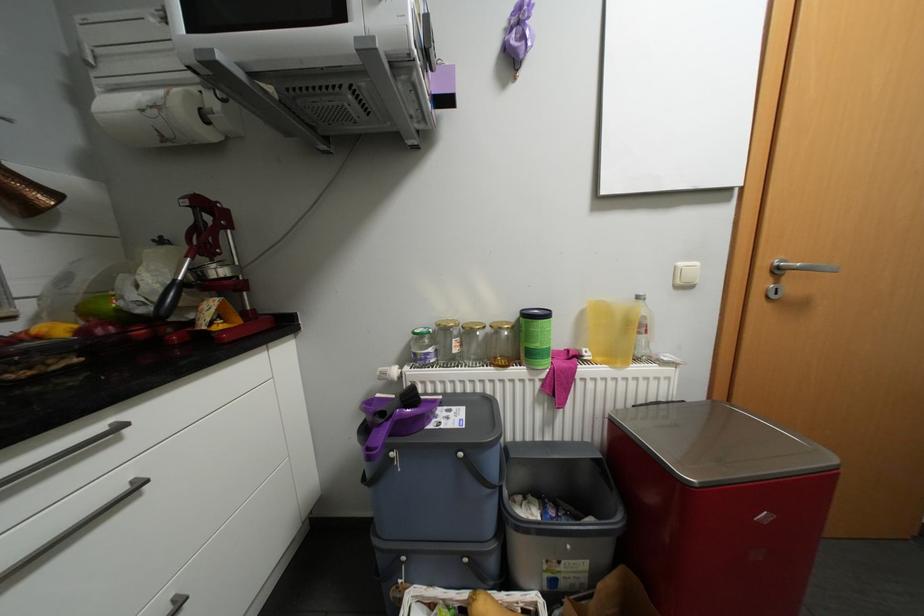
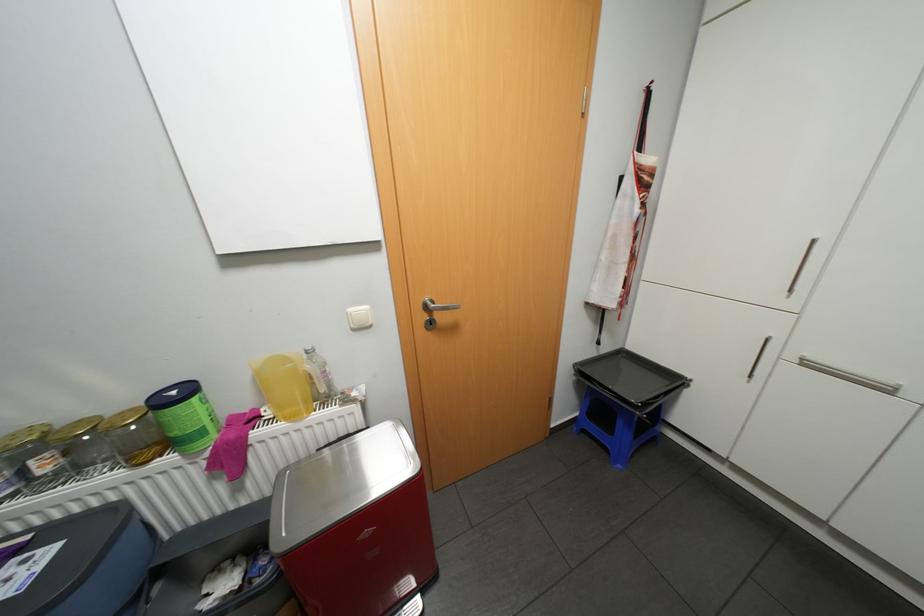
Find the pixel in the second image that matches pixel 462 339 in the first image.

(39, 461)